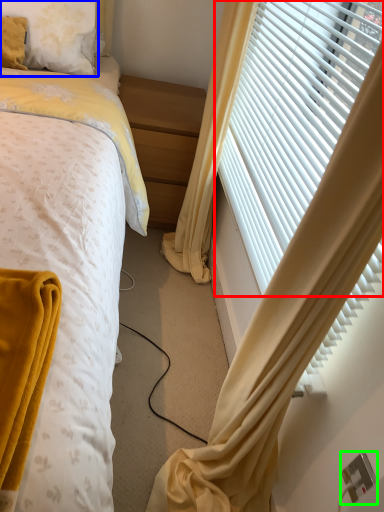
Question: Estimate the real-world distances between objects in this image. Which object is farther from window blind (highlighted by a red box), pillow (highlighted by a blue box) or electric outlet (highlighted by a green box)?

Choices:
 (A) pillow
 (B) electric outlet

Answer: (B)